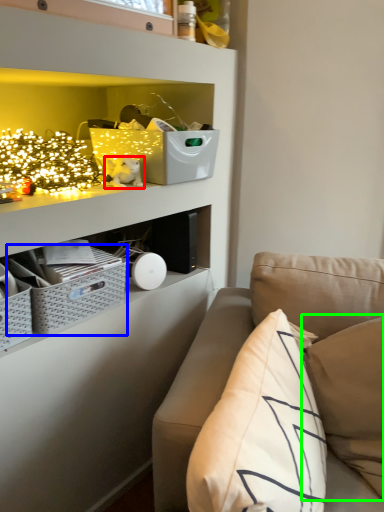
Question: Based on their relative distances, which object is farther from toy (highlighted by a red box)? Choose from crate (highlighted by a blue box) and pillow (highlighted by a green box).

Choices:
 (A) crate
 (B) pillow

Answer: (B)